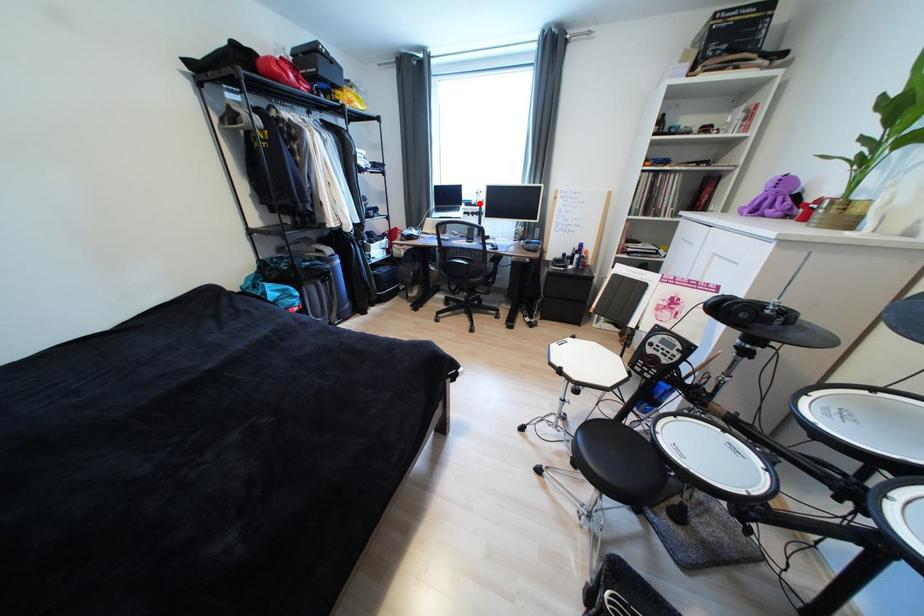
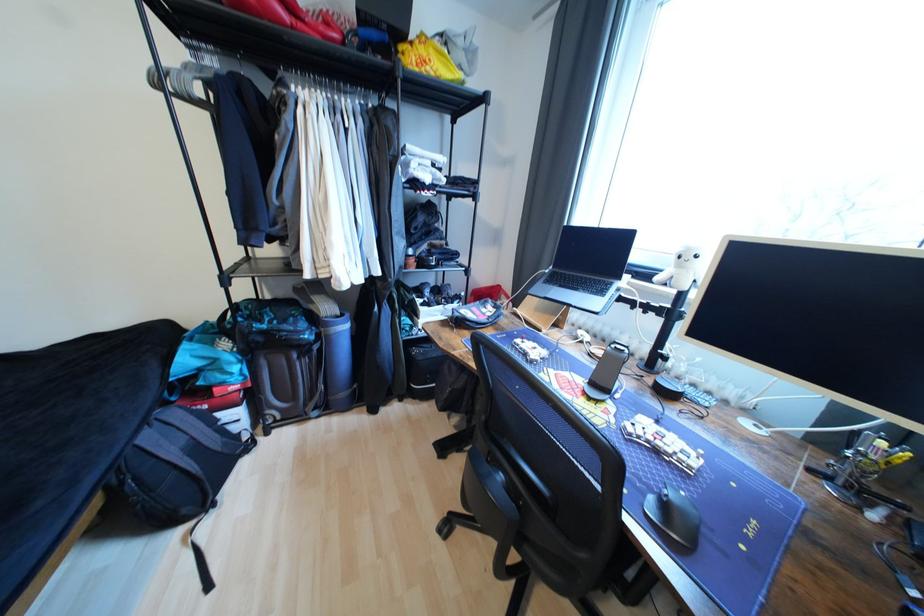
Question: I am providing you with two images of the same scene from different viewpoints. Given a red point in image1, look at the same physical point in image2. Is it:

Choices:
 (A) Closer to the viewpoint
 (B) Farther from the viewpoint

Answer: (B)